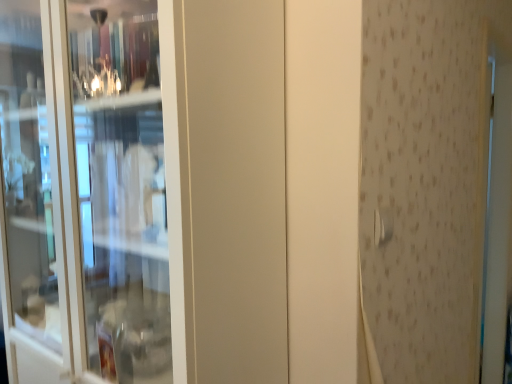
Question: Does point (381, 228) appear closer or farther from the camera than point (30, 364)?

Choices:
 (A) closer
 (B) farther

Answer: (A)

Question: From their relative heights in the image, would you say satin silver door handle at upper right is taller or shorter than transparent glass screen door at left?

Choices:
 (A) short
 (B) tall

Answer: (A)

Question: From a real-world perspective, is satin silver door handle at upper right positioned above or below transparent glass screen door at left?

Choices:
 (A) below
 (B) above

Answer: (B)

Question: Is transparent glass screen door at left to the left or to the right of satin silver door handle at upper right in the image?

Choices:
 (A) right
 (B) left

Answer: (B)

Question: From the image's perspective, is transparent glass screen door at left above or below satin silver door handle at upper right?

Choices:
 (A) below
 (B) above

Answer: (B)

Question: From a real-world perspective, relative to satin silver door handle at upper right, is transparent glass screen door at left vertically above or below?

Choices:
 (A) above
 (B) below

Answer: (B)

Question: In terms of size, does transparent glass screen door at left appear bigger or smaller than satin silver door handle at upper right?

Choices:
 (A) small
 (B) big

Answer: (B)